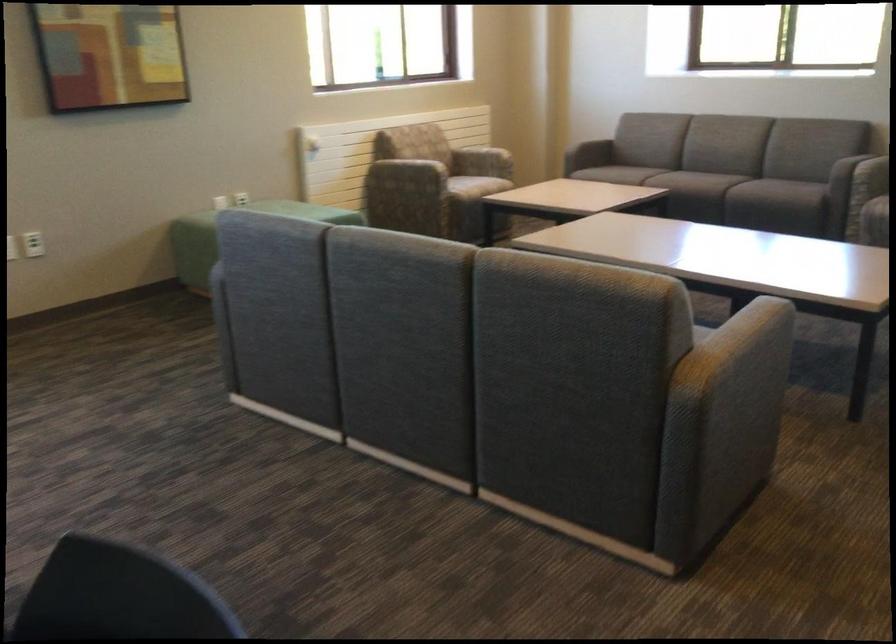
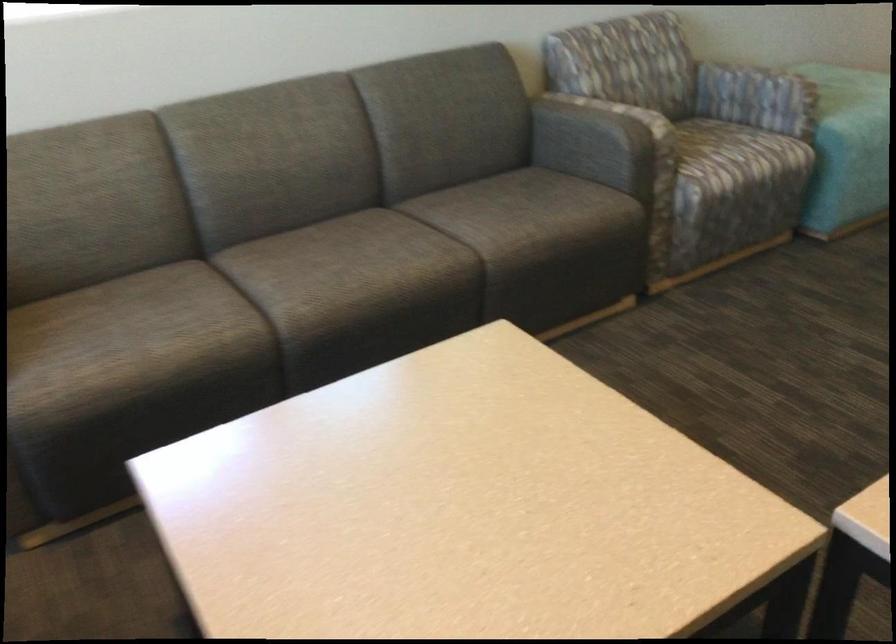
In the second image, find the point that corresponds to point (813, 163) in the first image.

(597, 140)